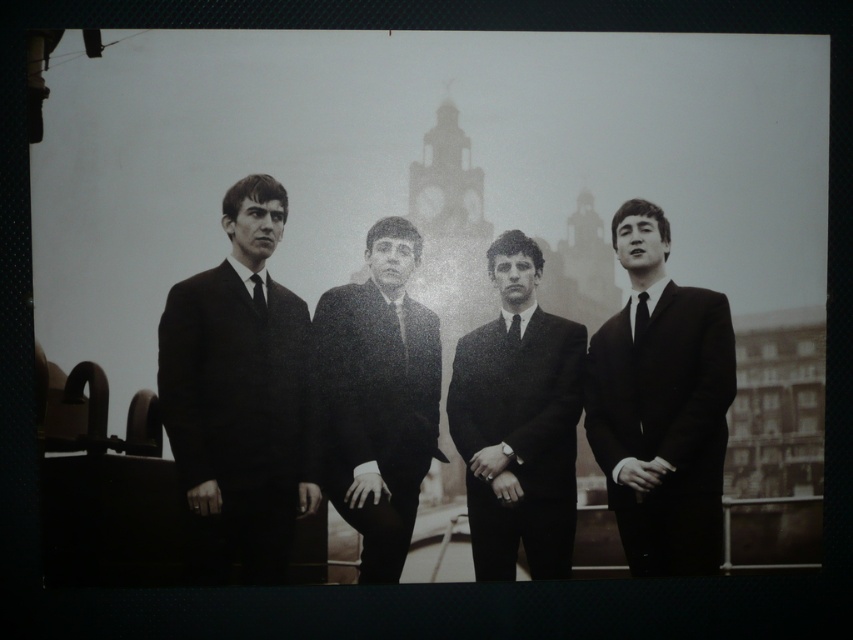
You are a tailor who needs to adjust the height of two ties, the matte black tie at center and the black silk tie at center, to ensure they are the same length. Which tie should you shorten and which one lengthen?

The matte black tie at center is taller than the black silk tie at center. To make them the same length, shorten the matte black tie at center and lengthen the black silk tie at center.